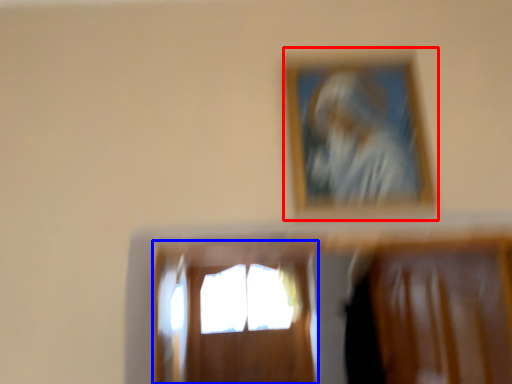
Question: Which of the following is the farthest to the observer, picture frame (highlighted by a red box) or window (highlighted by a blue box)?

Choices:
 (A) picture frame
 (B) window

Answer: (B)